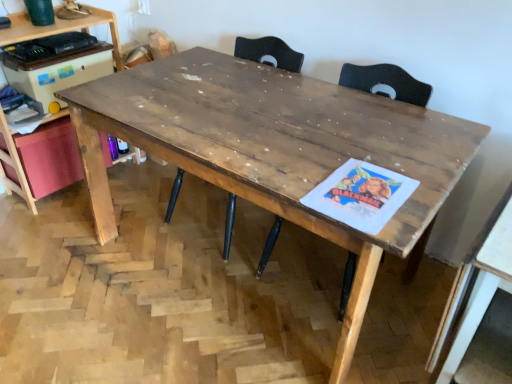
Question: Is wooden computer desk at left not close to wooden table at right, which is the second table from left to right?

Choices:
 (A) yes
 (B) no

Answer: (A)

Question: Considering the relative positions of wooden computer desk at left and wooden table at right, which is the second table from left to right, in the image provided, is wooden computer desk at left to the right of wooden table at right, which is the second table from left to right, from the viewer's perspective?

Choices:
 (A) yes
 (B) no

Answer: (B)

Question: Can you confirm if wooden computer desk at left is smaller than wooden table at right, the 1th table when ordered from right to left?

Choices:
 (A) yes
 (B) no

Answer: (B)

Question: Can you confirm if wooden computer desk at left is wider than wooden table at right, the 1th table when ordered from right to left?

Choices:
 (A) yes
 (B) no

Answer: (B)

Question: Is wooden computer desk at left bigger than wooden table at right, the 1th table when ordered from right to left?

Choices:
 (A) no
 (B) yes

Answer: (B)

Question: From a real-world perspective, relative to wooden swivel chair at center, is wooden table at center, placed as the second table when sorted from right to left, vertically above or below?

Choices:
 (A) below
 (B) above

Answer: (A)

Question: Looking at their shapes, would you say wooden table at center, placed as the 1th table when sorted from left to right, is wider or thinner than wooden swivel chair at center?

Choices:
 (A) thin
 (B) wide

Answer: (B)

Question: From the image's perspective, relative to wooden swivel chair at center, is wooden table at center, placed as the second table when sorted from right to left, above or below?

Choices:
 (A) above
 (B) below

Answer: (B)

Question: Considering the positions of point tap(337, 355) and point tap(300, 69), is point tap(337, 355) closer or farther from the camera than point tap(300, 69)?

Choices:
 (A) closer
 (B) farther

Answer: (A)

Question: From their relative heights in the image, would you say wooden table at right, the 1th table when ordered from right to left, is taller or shorter than wooden swivel chair at center?

Choices:
 (A) short
 (B) tall

Answer: (A)

Question: Relative to wooden swivel chair at center, is wooden table at right, which is the second table from left to right, in front or behind?

Choices:
 (A) front
 (B) behind

Answer: (A)

Question: Is wooden table at right, which is the second table from left to right, inside or outside of wooden swivel chair at center?

Choices:
 (A) outside
 (B) inside

Answer: (A)

Question: In terms of size, does wooden table at right, the 1th table when ordered from right to left, appear bigger or smaller than wooden swivel chair at center?

Choices:
 (A) small
 (B) big

Answer: (A)

Question: In the image, is wooden table at right, which is the second table from left to right, on the left side or the right side of wooden computer desk at left?

Choices:
 (A) left
 (B) right

Answer: (B)

Question: Relative to wooden computer desk at left, is wooden table at right, the 1th table when ordered from right to left, in front or behind?

Choices:
 (A) behind
 (B) front

Answer: (B)